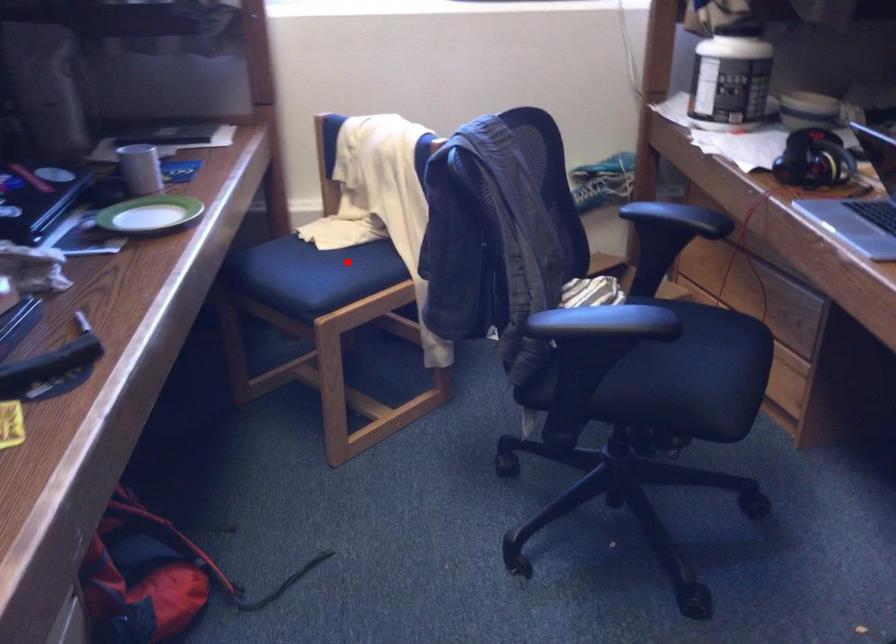
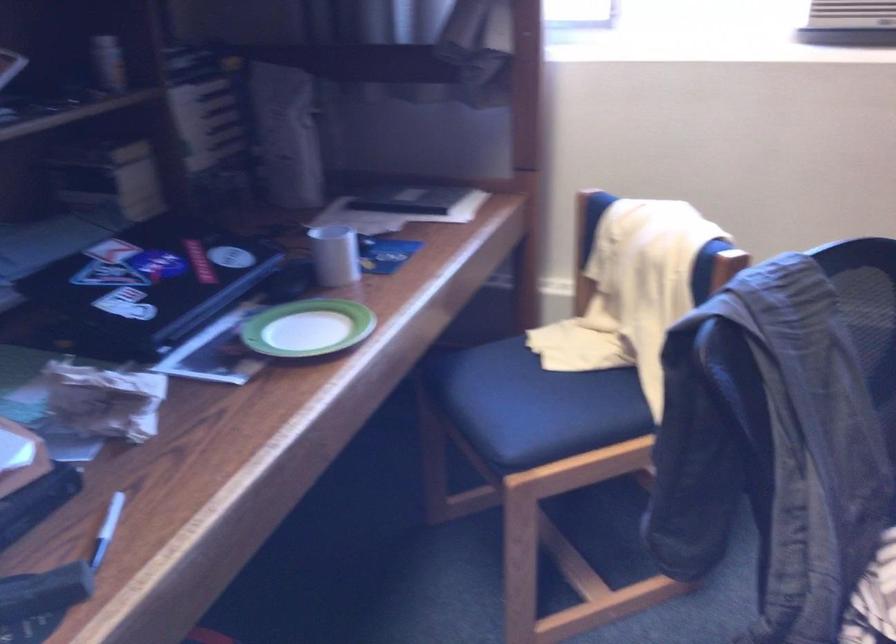
Where in the second image is the point corresponding to the highlighted location from the first image?

(576, 393)